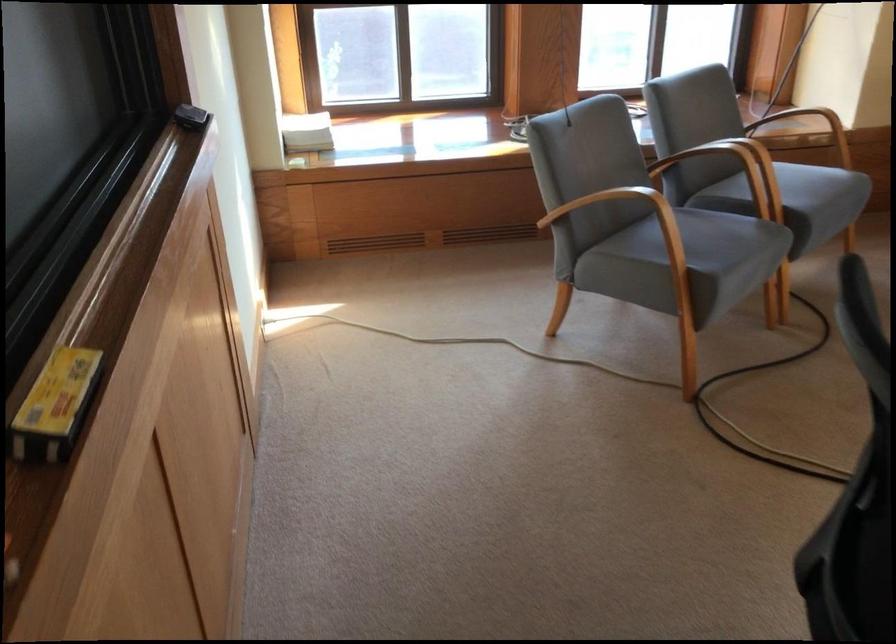
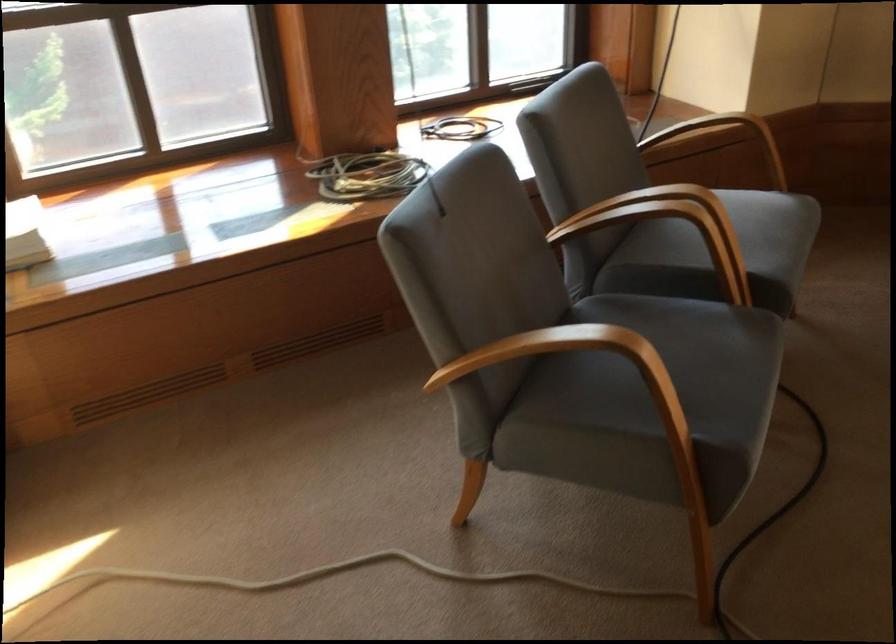
Question: The images are taken continuously from a first-person perspective. In which direction are you moving?

Choices:
 (A) Left
 (B) Right
 (C) Forward
 (D) Backward

Answer: (C)